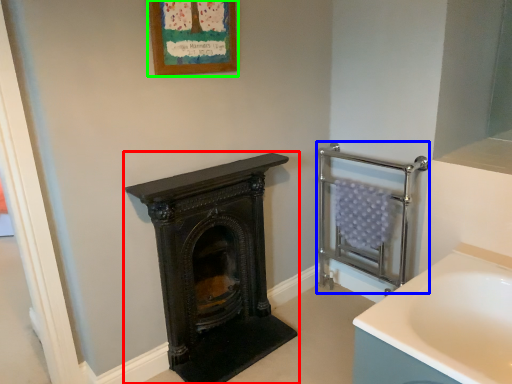
Question: Based on their relative distances, which object is farther from wood burning stove (highlighted by a red box)? Choose from balustrade (highlighted by a blue box) and picture frame (highlighted by a green box).

Choices:
 (A) balustrade
 (B) picture frame

Answer: (B)